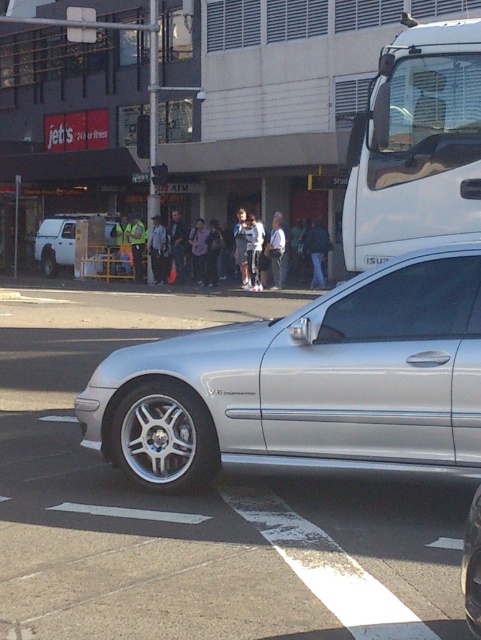
Who is more distant from viewer, (x=125, y=435) or (x=72, y=248)?

The point (x=72, y=248) is behind.

Is silver metallic wheel at lower left wider than white matte van at left?

In fact, silver metallic wheel at lower left might be narrower than white matte van at left.

Which is behind, point (173, 461) or point (71, 252)?

Point (71, 252)

This screenshot has height=640, width=481. Find the location of `silver metallic wheel at lower left`. silver metallic wheel at lower left is located at coordinates (163, 436).

Can you confirm if metallic silver truck at upper right is positioned to the left of brushed metal wheel at lower left?

In fact, metallic silver truck at upper right is to the right of brushed metal wheel at lower left.

Between metallic silver truck at upper right and brushed metal wheel at lower left, which one appears on the right side from the viewer's perspective?

Positioned to the right is metallic silver truck at upper right.

What do you see at coordinates (416, 145) in the screenshot?
I see `metallic silver truck at upper right` at bounding box center [416, 145].

This screenshot has height=640, width=481. Find the location of `metallic silver truck at upper right`. metallic silver truck at upper right is located at coordinates (416, 145).

Who is lower down, silver metallic rim at center or brushed metal wheel at lower left?

silver metallic rim at center

Where is `silver metallic rim at center`? The image size is (481, 640). silver metallic rim at center is located at coordinates (157, 438).